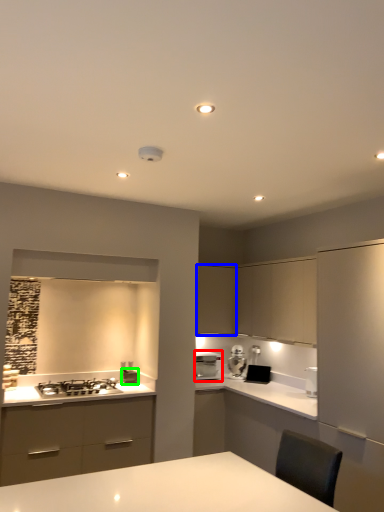
Question: Which object is the closest to the home appliance (highlighted by a red box)? Choose among these: cabinetry (highlighted by a blue box) or appliance (highlighted by a green box).

Choices:
 (A) cabinetry
 (B) appliance

Answer: (A)